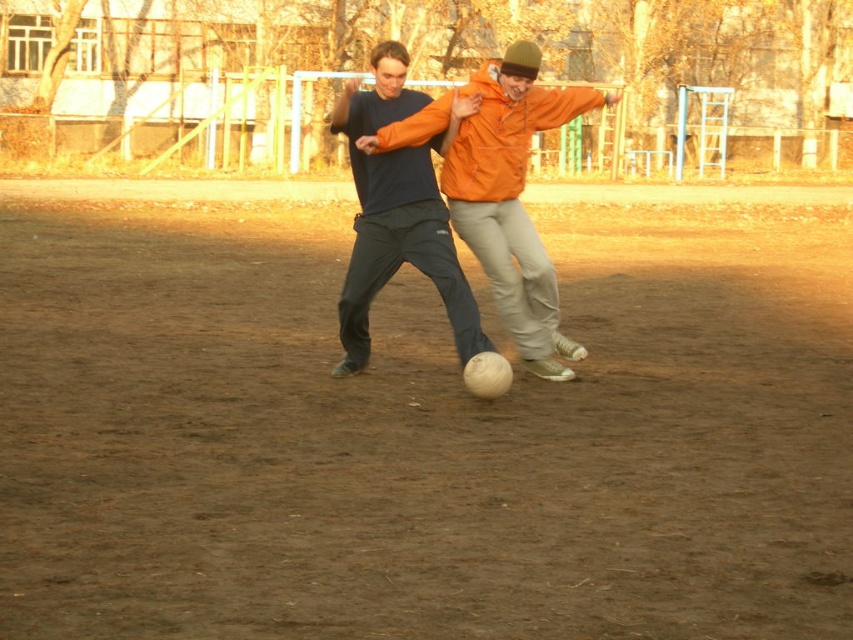
Question: Estimate the real-world distances between objects in this image. Which object is closer to the matte black pants at center?

Choices:
 (A) orange matte jacket at center
 (B) brown dirt field at center

Answer: (A)

Question: Observing the image, what is the correct spatial positioning of brown dirt field at center in reference to matte black pants at center?

Choices:
 (A) left
 (B) right

Answer: (B)

Question: Is brown dirt field at center above matte black pants at center?

Choices:
 (A) yes
 (B) no

Answer: (B)

Question: Which point is closer to the camera?

Choices:
 (A) matte black pants at center
 (B) orange matte jacket at center

Answer: (A)

Question: From the image, what is the correct spatial relationship of brown dirt field at center in relation to matte black pants at center?

Choices:
 (A) below
 (B) above

Answer: (A)

Question: Estimate the real-world distances between objects in this image. Which object is closer to the matte black pants at center?

Choices:
 (A) orange matte jacket at center
 (B) brown dirt field at center

Answer: (A)